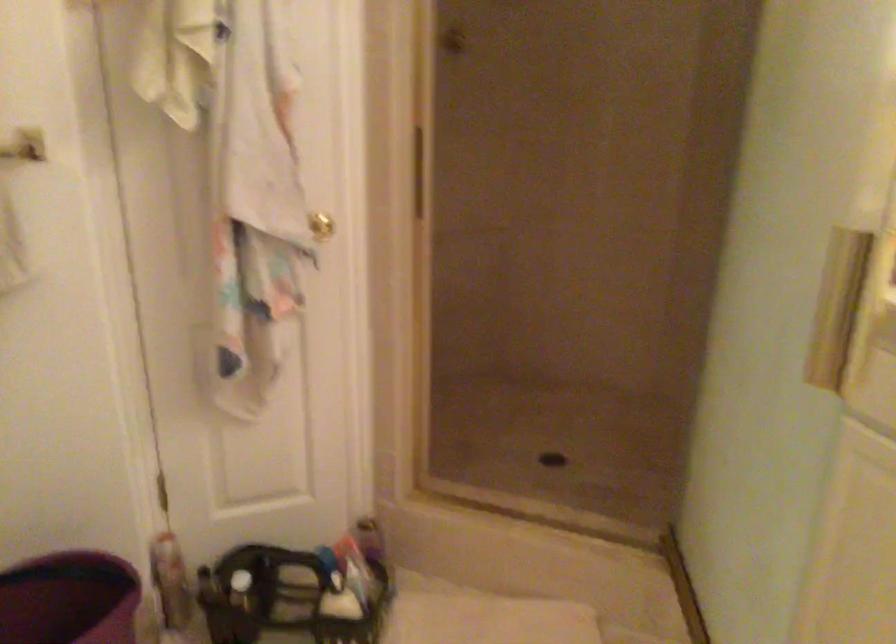
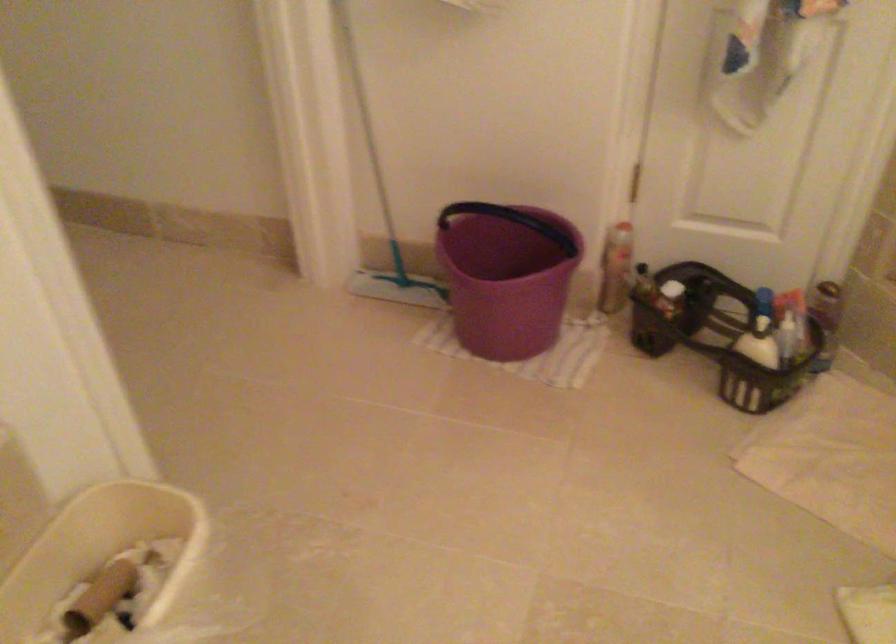
Looking at this image, based on the continuous images, in which direction is the camera rotating?

The camera's rotation is toward left-down.